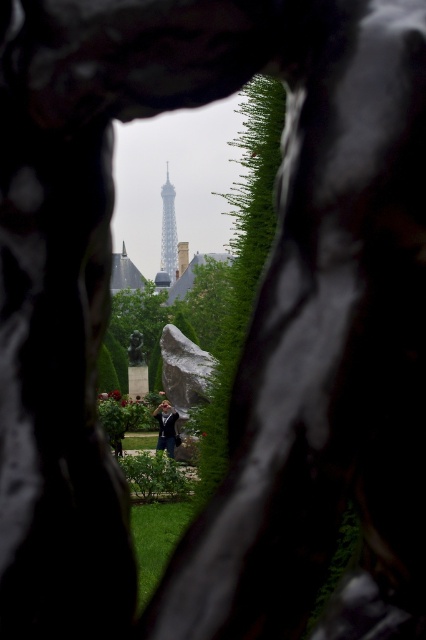
Question: Can you confirm if silver metallic eiffel tower at center is wider than dark blue fabric jacket at center?

Choices:
 (A) no
 (B) yes

Answer: (B)

Question: Is silver metallic eiffel tower at center wider than dark blue fabric jacket at center?

Choices:
 (A) yes
 (B) no

Answer: (A)

Question: Among these objects, which one is farthest from the camera?

Choices:
 (A) dark blue fabric jacket at center
 (B) silver metallic eiffel tower at center

Answer: (B)

Question: Which point is farther to the camera?

Choices:
 (A) (172, 208)
 (B) (173, 412)

Answer: (A)

Question: Which object appears closest to the camera in this image?

Choices:
 (A) dark blue fabric jacket at center
 (B) silver metallic eiffel tower at center

Answer: (A)

Question: Can you confirm if silver metallic eiffel tower at center is positioned below dark blue fabric jacket at center?

Choices:
 (A) no
 (B) yes

Answer: (A)